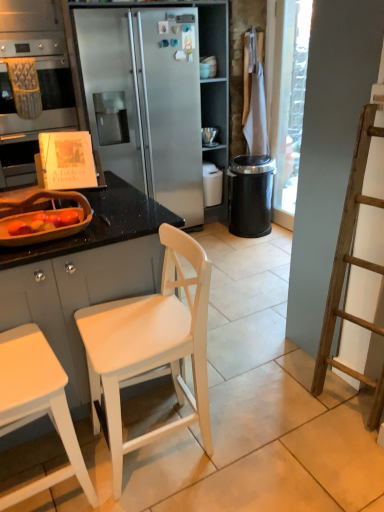
Question: Is there a large distance between black plastic trash can at center-right and brushed metal oven at left, which ranks as the 1th cabinetry in top-to-bottom order?

Choices:
 (A) no
 (B) yes

Answer: (B)

Question: From the image's perspective, is black plastic trash can at center-right beneath brushed metal oven at left, which is the 2th cabinetry in front-to-back order?

Choices:
 (A) yes
 (B) no

Answer: (A)

Question: Can you confirm if black plastic trash can at center-right is shorter than brushed metal oven at left, the 1th cabinetry when ordered from back to front?

Choices:
 (A) no
 (B) yes

Answer: (B)

Question: Is black plastic trash can at center-right completely or partially outside of brushed metal oven at left, the 1th cabinetry when ordered from back to front?

Choices:
 (A) no
 (B) yes

Answer: (B)

Question: Does black plastic trash can at center-right appear on the right side of brushed metal oven at left, which is the 2th cabinetry in front-to-back order?

Choices:
 (A) yes
 (B) no

Answer: (A)

Question: Is the surface of black plastic trash can at center-right in direct contact with brushed metal oven at left, which ranks as the 1th cabinetry in top-to-bottom order?

Choices:
 (A) no
 (B) yes

Answer: (A)

Question: Is black plastic trash can at center-right in front of white matte cabinet at left, arranged as the 1th cabinetry when viewed from the front?

Choices:
 (A) no
 (B) yes

Answer: (A)

Question: From a real-world perspective, is black plastic trash can at center-right physically above white matte cabinet at left, arranged as the 1th cabinetry when viewed from the front?

Choices:
 (A) yes
 (B) no

Answer: (B)

Question: Is black plastic trash can at center-right beside white matte cabinet at left, arranged as the 1th cabinetry when viewed from the front?

Choices:
 (A) no
 (B) yes

Answer: (A)

Question: Is black plastic trash can at center-right located outside white matte cabinet at left, arranged as the 1th cabinetry when viewed from the front?

Choices:
 (A) no
 (B) yes

Answer: (B)

Question: Can you confirm if black plastic trash can at center-right is thinner than white matte cabinet at left, which is the 1th cabinetry from bottom to top?

Choices:
 (A) no
 (B) yes

Answer: (B)

Question: Does black plastic trash can at center-right appear on the left side of white matte cabinet at left, arranged as the 1th cabinetry when viewed from the front?

Choices:
 (A) yes
 (B) no

Answer: (B)

Question: From a real-world perspective, is white wood chair at center located beneath black plastic trash can at center-right?

Choices:
 (A) yes
 (B) no

Answer: (B)